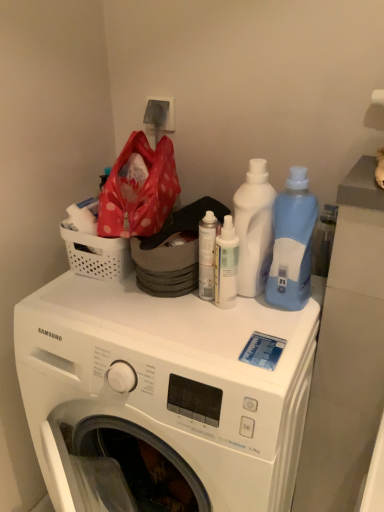
The height and width of the screenshot is (512, 384). Identify the location of white matte spray can at center. (207, 255).

What do you see at coordinates (254, 228) in the screenshot?
I see `white plastic bottle at center, positioned as the second cleaning product in right-to-left order` at bounding box center [254, 228].

The image size is (384, 512). I want to click on white glossy spray can at center, arranged as the 3th cleaning product when viewed from the right, so click(226, 265).

The image size is (384, 512). What do you see at coordinates (96, 254) in the screenshot?
I see `white perforated basket at upper left` at bounding box center [96, 254].

At what (x,y) coordinates should I click in order to perform the action: click on blue translucent bottle at right, which is the 1th cleaning product in right-to-left order. Please return your answer as a coordinate pair (x, y). This screenshot has width=384, height=512. Looking at the image, I should click on (292, 243).

The image size is (384, 512). I want to click on white plastic washing machine at center, so click(163, 395).

Relative to white plastic washing machine at center, is white glossy spray can at center, arranged as the first cleaning product when viewed from the left, in front or behind?

Visually, white glossy spray can at center, arranged as the first cleaning product when viewed from the left, is located behind white plastic washing machine at center.

Is white glossy spray can at center, arranged as the first cleaning product when viewed from the left, outside of white plastic washing machine at center?

That's correct, white glossy spray can at center, arranged as the first cleaning product when viewed from the left, is outside of white plastic washing machine at center.

Between white glossy spray can at center, arranged as the first cleaning product when viewed from the left, and white plastic washing machine at center, which one appears on the right side from the viewer's perspective?

white glossy spray can at center, arranged as the first cleaning product when viewed from the left.

Which object is further away from the camera taking this photo, white plastic bottle at center, acting as the second cleaning product starting from the left, or blue translucent bottle at right, which is the 1th cleaning product in right-to-left order?

white plastic bottle at center, acting as the second cleaning product starting from the left, is behind.

Based on the photo, can you confirm if white plastic bottle at center, acting as the second cleaning product starting from the left, is shorter than blue translucent bottle at right, which is the 1th cleaning product in right-to-left order?

No, white plastic bottle at center, acting as the second cleaning product starting from the left, is not shorter than blue translucent bottle at right, which is the 1th cleaning product in right-to-left order.

In terms of size, does white plastic bottle at center, acting as the second cleaning product starting from the left, appear bigger or smaller than blue translucent bottle at right, acting as the 3th cleaning product starting from the left?

Considering their sizes, white plastic bottle at center, acting as the second cleaning product starting from the left, takes up less space than blue translucent bottle at right, acting as the 3th cleaning product starting from the left.

Which of these two, white plastic washing machine at center or white plastic bottle at center, acting as the second cleaning product starting from the left, is smaller?

Smaller between the two is white plastic bottle at center, acting as the second cleaning product starting from the left.

This screenshot has width=384, height=512. I want to click on washing machine that appears below the white plastic bottle at center, positioned as the second cleaning product in right-to-left order (from the image's perspective), so click(x=163, y=395).

Considering the positions of point (304, 228) and point (233, 289), is point (304, 228) closer or farther from the camera than point (233, 289)?

Point (304, 228) is closer to the camera than point (233, 289).

Which object is thinner, blue translucent bottle at right, which is the 1th cleaning product in right-to-left order, or white glossy spray can at center, arranged as the first cleaning product when viewed from the left?

white glossy spray can at center, arranged as the first cleaning product when viewed from the left.

Locate an element on the screen. This screenshot has height=512, width=384. cleaning product in front of the white glossy spray can at center, arranged as the 3th cleaning product when viewed from the right is located at coordinates (292, 243).

From the image's perspective, is white plastic washing machine at center above or below white glossy spray can at center, arranged as the first cleaning product when viewed from the left?

From the image's perspective, white plastic washing machine at center appears below white glossy spray can at center, arranged as the first cleaning product when viewed from the left.

Is white plastic washing machine at center shorter than white glossy spray can at center, arranged as the first cleaning product when viewed from the left?

No, white plastic washing machine at center is not shorter than white glossy spray can at center, arranged as the first cleaning product when viewed from the left.

Consider the image. Does white plastic washing machine at center appear on the left side of white glossy spray can at center, arranged as the 3th cleaning product when viewed from the right?

Yes, white plastic washing machine at center is to the left of white glossy spray can at center, arranged as the 3th cleaning product when viewed from the right.

Is white plastic washing machine at center thinner than white glossy spray can at center, arranged as the first cleaning product when viewed from the left?

No.

What's the angular difference between white plastic washing machine at center and blue translucent bottle at right, acting as the 3th cleaning product starting from the left,'s facing directions?

The facing directions of white plastic washing machine at center and blue translucent bottle at right, acting as the 3th cleaning product starting from the left, are 0.000176 degrees apart.

Is white plastic washing machine at center next to blue translucent bottle at right, which is the 1th cleaning product in right-to-left order, and touching it?

No.

Which of these two, white plastic washing machine at center or blue translucent bottle at right, which is the 1th cleaning product in right-to-left order, stands shorter?

blue translucent bottle at right, which is the 1th cleaning product in right-to-left order.

From the image's perspective, which object appears higher, white plastic washing machine at center or blue translucent bottle at right, which is the 1th cleaning product in right-to-left order?

blue translucent bottle at right, which is the 1th cleaning product in right-to-left order, appears higher in the image.

From a real-world perspective, which is physically above, white matte spray can at center or white perforated basket at upper left?

white perforated basket at upper left is physically above.

Does white matte spray can at center have a larger size compared to white perforated basket at upper left?

No, white matte spray can at center is not bigger than white perforated basket at upper left.

Between white matte spray can at center and white perforated basket at upper left, which one is positioned in front?

white matte spray can at center.

The image size is (384, 512). In order to click on washing machine in front of the white glossy spray can at center, arranged as the first cleaning product when viewed from the left in this screenshot , I will do `click(163, 395)`.

The image size is (384, 512). Find the location of `the 2nd cleaning product behind when counting from the blue translucent bottle at right, which is the 1th cleaning product in right-to-left order`. the 2nd cleaning product behind when counting from the blue translucent bottle at right, which is the 1th cleaning product in right-to-left order is located at coordinates (254, 228).

Which object lies nearer to the anchor point white perforated basket at upper left, white plastic bottle at center, acting as the second cleaning product starting from the left, or white glossy spray can at center, arranged as the 3th cleaning product when viewed from the right?

Based on the image, white glossy spray can at center, arranged as the 3th cleaning product when viewed from the right, appears to be nearer to white perforated basket at upper left.

When comparing their distances from white plastic washing machine at center, does white plastic bottle at center, acting as the second cleaning product starting from the left, or blue translucent bottle at right, acting as the 3th cleaning product starting from the left, seem further?

blue translucent bottle at right, acting as the 3th cleaning product starting from the left.

When comparing their distances from white plastic washing machine at center, does white plastic bottle at center, acting as the second cleaning product starting from the left, or white glossy spray can at center, arranged as the 3th cleaning product when viewed from the right, seem further?

Based on the image, white plastic bottle at center, acting as the second cleaning product starting from the left, appears to be further to white plastic washing machine at center.

Estimate the real-world distances between objects in this image. Which object is closer to white plastic washing machine at center, white matte spray can at center or white glossy spray can at center, arranged as the first cleaning product when viewed from the left?

Based on the image, white glossy spray can at center, arranged as the first cleaning product when viewed from the left, appears to be nearer to white plastic washing machine at center.

Estimate the real-world distances between objects in this image. Which object is closer to white matte spray can at center, white perforated basket at upper left or blue translucent bottle at right, acting as the 3th cleaning product starting from the left?

blue translucent bottle at right, acting as the 3th cleaning product starting from the left, is positioned closer to the anchor white matte spray can at center.

When comparing their distances from white matte spray can at center, does white plastic bottle at center, acting as the second cleaning product starting from the left, or white perforated basket at upper left seem further?

white perforated basket at upper left is positioned further to the anchor white matte spray can at center.

Which object lies further to the anchor point white perforated basket at upper left, white plastic bottle at center, positioned as the second cleaning product in right-to-left order, or white plastic washing machine at center?

white plastic bottle at center, positioned as the second cleaning product in right-to-left order.

Considering their positions, is white perforated basket at upper left positioned further to white glossy spray can at center, arranged as the first cleaning product when viewed from the left, than white plastic washing machine at center?

The object further to white glossy spray can at center, arranged as the first cleaning product when viewed from the left, is white plastic washing machine at center.

This screenshot has height=512, width=384. Find the location of `cleaning product between white glossy spray can at center, arranged as the 3th cleaning product when viewed from the right, and blue translucent bottle at right, acting as the 3th cleaning product starting from the left, from left to right`. cleaning product between white glossy spray can at center, arranged as the 3th cleaning product when viewed from the right, and blue translucent bottle at right, acting as the 3th cleaning product starting from the left, from left to right is located at coordinates (254, 228).

Image resolution: width=384 pixels, height=512 pixels. I want to click on bottle between white plastic bottle at center, positioned as the second cleaning product in right-to-left order, and white plastic washing machine at center from top to bottom, so click(x=207, y=255).

Find the location of a particular element. This screenshot has width=384, height=512. cleaning product located between white matte spray can at center and white plastic bottle at center, positioned as the second cleaning product in right-to-left order, in the left-right direction is located at coordinates (226, 265).

This screenshot has height=512, width=384. Find the location of `basket between white plastic bottle at center, positioned as the second cleaning product in right-to-left order, and white plastic washing machine at center from top to bottom`. basket between white plastic bottle at center, positioned as the second cleaning product in right-to-left order, and white plastic washing machine at center from top to bottom is located at coordinates (96, 254).